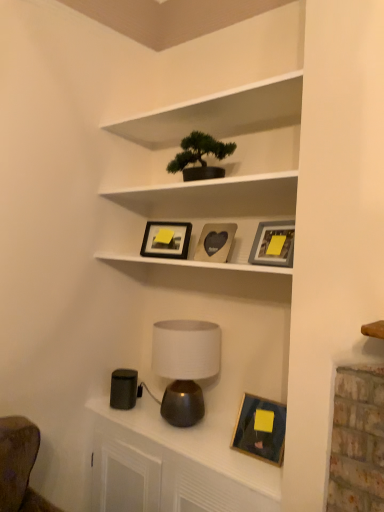
Question: Does green matte bonsai tree at upper center have a lesser width compared to wooden heart-shaped photo frame at center, which is the third picture frame in bottom-to-top order?

Choices:
 (A) yes
 (B) no

Answer: (B)

Question: Can you confirm if green matte bonsai tree at upper center is taller than wooden heart-shaped photo frame at center, which is the third picture frame in bottom-to-top order?

Choices:
 (A) no
 (B) yes

Answer: (A)

Question: Does green matte bonsai tree at upper center appear on the left side of wooden heart-shaped photo frame at center, which is the third picture frame in bottom-to-top order?

Choices:
 (A) no
 (B) yes

Answer: (B)

Question: Is green matte bonsai tree at upper center outside wooden heart-shaped photo frame at center, which is the second picture frame from top to bottom?

Choices:
 (A) yes
 (B) no

Answer: (A)

Question: Does green matte bonsai tree at upper center turn towards wooden heart-shaped photo frame at center, which is the third picture frame in bottom-to-top order?

Choices:
 (A) no
 (B) yes

Answer: (A)

Question: Is green matte bonsai tree at upper center shorter than wooden heart-shaped photo frame at center, which is the third picture frame in bottom-to-top order?

Choices:
 (A) no
 (B) yes

Answer: (B)

Question: Can you confirm if matte gray picture frame at upper center, the second picture frame from the bottom, is wider than green matte bonsai tree at upper center?

Choices:
 (A) no
 (B) yes

Answer: (A)

Question: Considering the relative sizes of matte gray picture frame at upper center, the second picture frame from the bottom, and green matte bonsai tree at upper center in the image provided, is matte gray picture frame at upper center, the second picture frame from the bottom, taller than green matte bonsai tree at upper center?

Choices:
 (A) no
 (B) yes

Answer: (A)

Question: Does matte gray picture frame at upper center, the 3th picture frame when ordered from top to bottom, lie in front of green matte bonsai tree at upper center?

Choices:
 (A) yes
 (B) no

Answer: (A)

Question: Does matte gray picture frame at upper center, the second picture frame from the bottom, have a lesser height compared to green matte bonsai tree at upper center?

Choices:
 (A) yes
 (B) no

Answer: (A)

Question: Is matte gray picture frame at upper center, the 3th picture frame when ordered from top to bottom, far away from green matte bonsai tree at upper center?

Choices:
 (A) no
 (B) yes

Answer: (A)

Question: Could green matte bonsai tree at upper center be considered to be inside matte gray picture frame at upper center, the 3th picture frame when ordered from top to bottom?

Choices:
 (A) no
 (B) yes

Answer: (A)

Question: From the image's perspective, is metallic lamp at lower center on matte gray picture frame at upper center, the 3th picture frame when ordered from top to bottom?

Choices:
 (A) yes
 (B) no

Answer: (B)